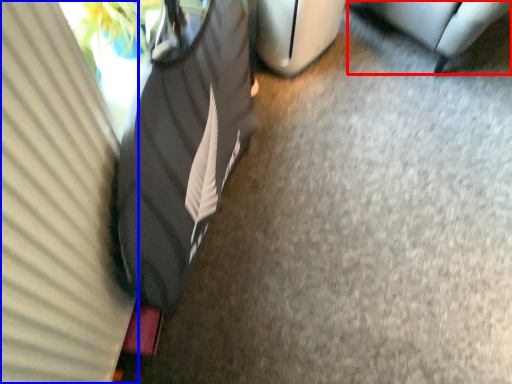
Question: Among these objects, which one is farthest to the camera, furniture (highlighted by a red box) or curtain (highlighted by a blue box)?

Choices:
 (A) furniture
 (B) curtain

Answer: (A)